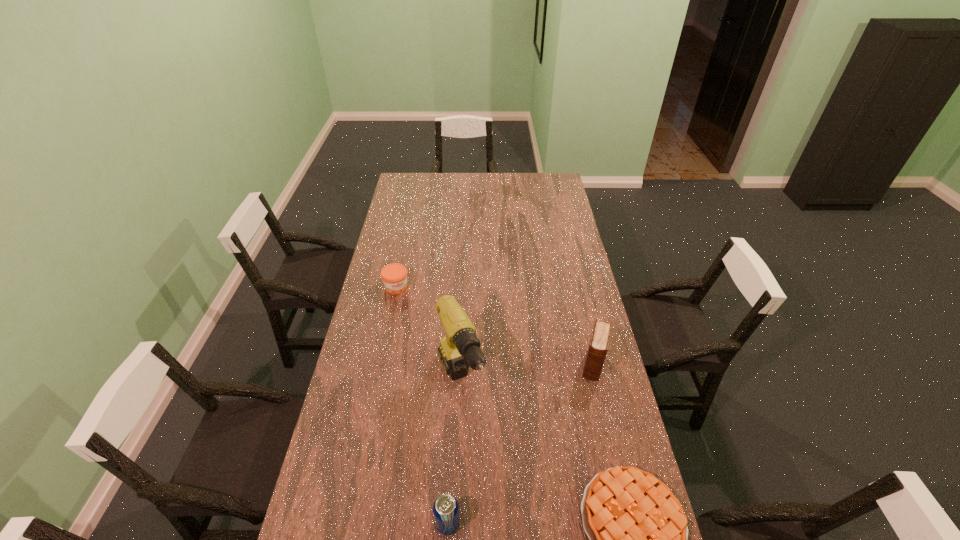
Image resolution: width=960 pixels, height=540 pixels. I want to click on vacant space on the desktop that is between the third tallest object and the pie and is positioned on the front label of the fourth tallest object, so pos(523,522).

The height and width of the screenshot is (540, 960). In order to click on vacant space on the desktop that is between the beer can and the shortest object and is positioned on the spine side of the diary in this screenshot , I will do `click(562, 521)`.

I want to click on free space on the desktop that is between the beer can and the pie and is positioned on the handle side of the tallest object, so click(x=527, y=522).